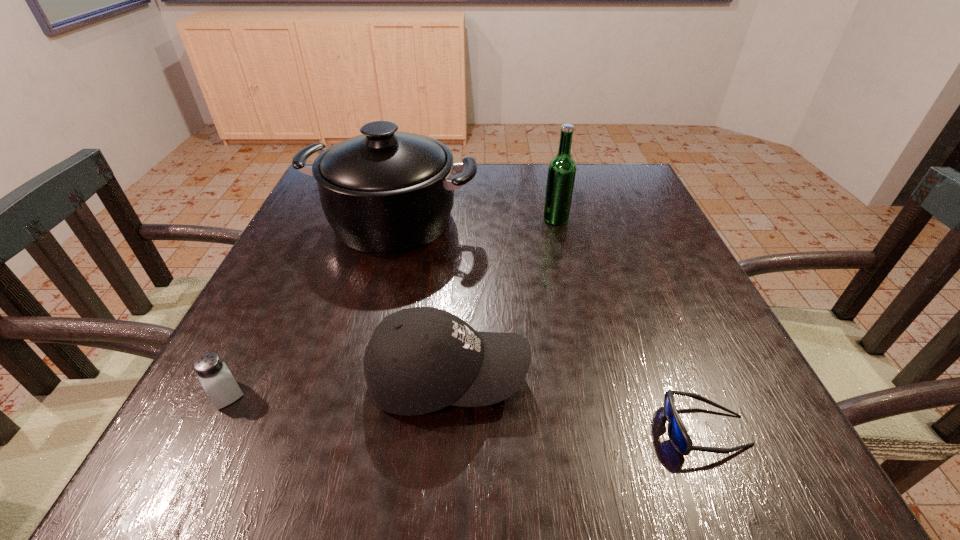
I want to click on free spot that satisfies the following two spatial constraints: 1. on the back side of the second shortest object; 2. on the right side of the second object from right to left, so click(316, 219).